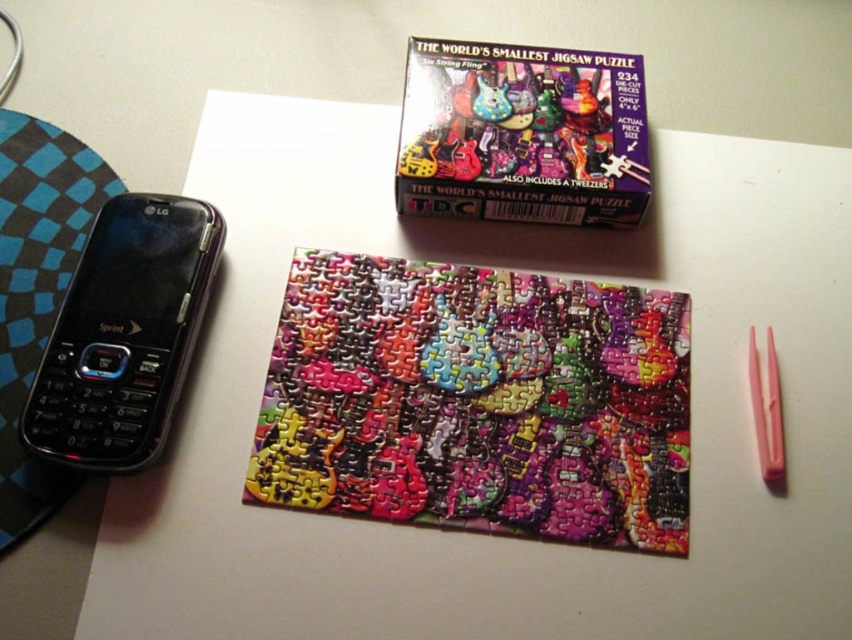
The width and height of the screenshot is (852, 640). What do you see at coordinates (476, 401) in the screenshot? I see `multicolored puzzle at center` at bounding box center [476, 401].

Is point (292, 486) positioned in front of point (32, 442)?

No, (292, 486) is further to viewer.

Where is `multicolored puzzle at center`? multicolored puzzle at center is located at coordinates (476, 401).

Where is `multicolored puzzle at center`? Image resolution: width=852 pixels, height=640 pixels. multicolored puzzle at center is located at coordinates (476, 401).

The width and height of the screenshot is (852, 640). What do you see at coordinates (522, 132) in the screenshot?
I see `multicolored plastic box at upper center` at bounding box center [522, 132].

The height and width of the screenshot is (640, 852). Find the location of `multicolored plastic box at upper center`. multicolored plastic box at upper center is located at coordinates (522, 132).

Where is `multicolored plastic box at upper center`? Image resolution: width=852 pixels, height=640 pixels. multicolored plastic box at upper center is located at coordinates (522, 132).

Is multicolored puzzle at center thinner than multicolored plastic box at upper center?

No, multicolored puzzle at center is not thinner than multicolored plastic box at upper center.

Can you confirm if multicolored puzzle at center is positioned to the right of multicolored plastic box at upper center?

No, multicolored puzzle at center is not to the right of multicolored plastic box at upper center.

Is point (634, 410) closer to camera compared to point (580, 104)?

Yes.

You are a GUI agent. You are given a task and a screenshot of the screen. Output one action in this format:
    pyautogui.click(x=<x>, y=<y>)
    Task: Click on the multicolored puzzle at center
    The image size is (852, 640).
    Given the screenshot: What is the action you would take?
    pyautogui.click(x=476, y=401)